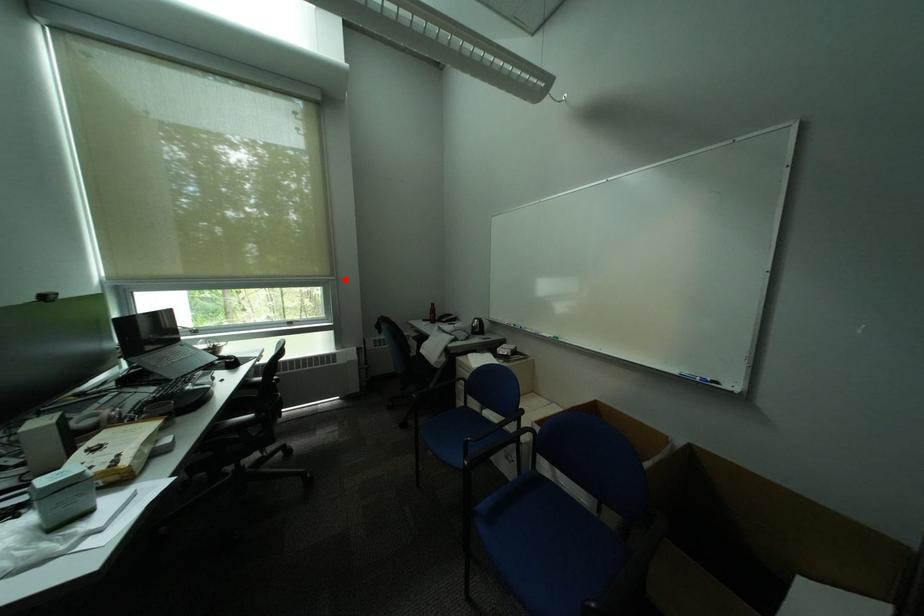
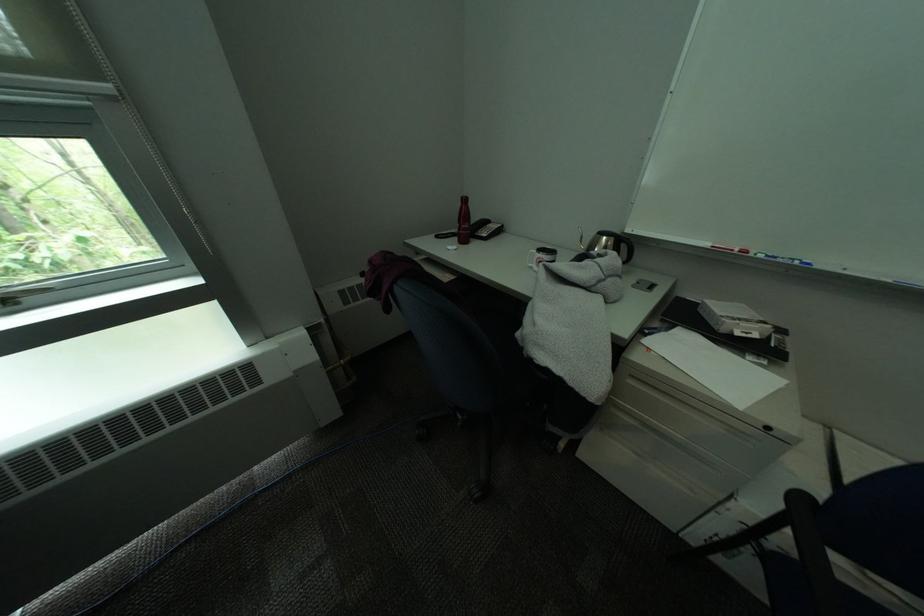
In the second image, find the point that corresponds to the highlighted location in the first image.

(119, 87)